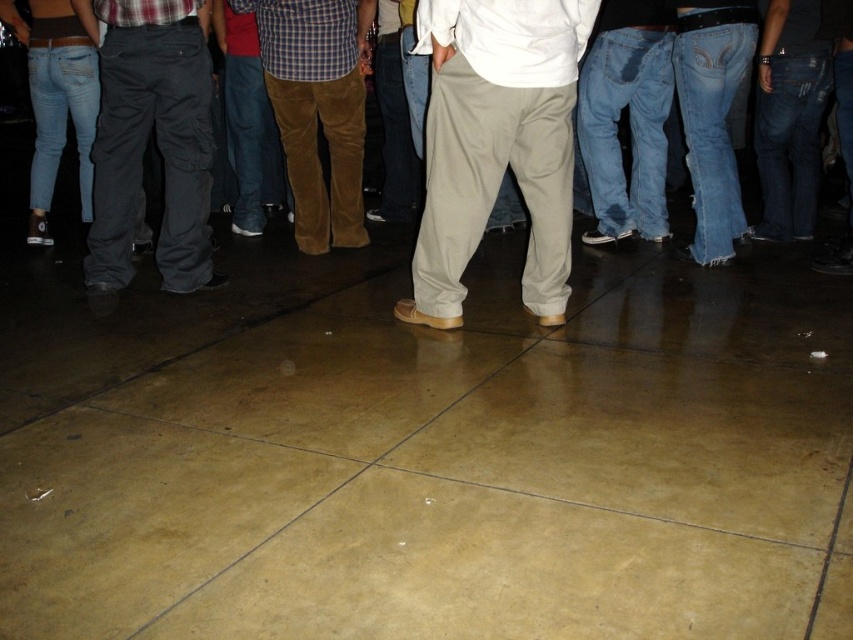
Which is in front, point (485, 168) or point (244, 19)?

Positioned in front is point (485, 168).

Between khaki pants at center and matte khaki pants at center, which one has less height?

With less height is khaki pants at center.

Is point (450, 230) more distant than point (846, 125)?

No, (450, 230) is in front of (846, 125).

Identify the location of khaki pants at center. (496, 144).

Based on the photo, how distant is khaki pants at center from dark gray cotton pants at left?

They are 5.04 feet apart.

Can you confirm if khaki pants at center is wider than dark gray cotton pants at left?

Correct, the width of khaki pants at center exceeds that of dark gray cotton pants at left.

Locate an element on the screen. The image size is (853, 640). khaki pants at center is located at coordinates (496, 144).

In the scene shown: Who is taller, khaki pants at center or brown corduroy pants at center?

brown corduroy pants at center

Measure the distance between khaki pants at center and camera.

A distance of 3.01 meters exists between khaki pants at center and camera.

Identify the location of khaki pants at center. The height and width of the screenshot is (640, 853). (496, 144).